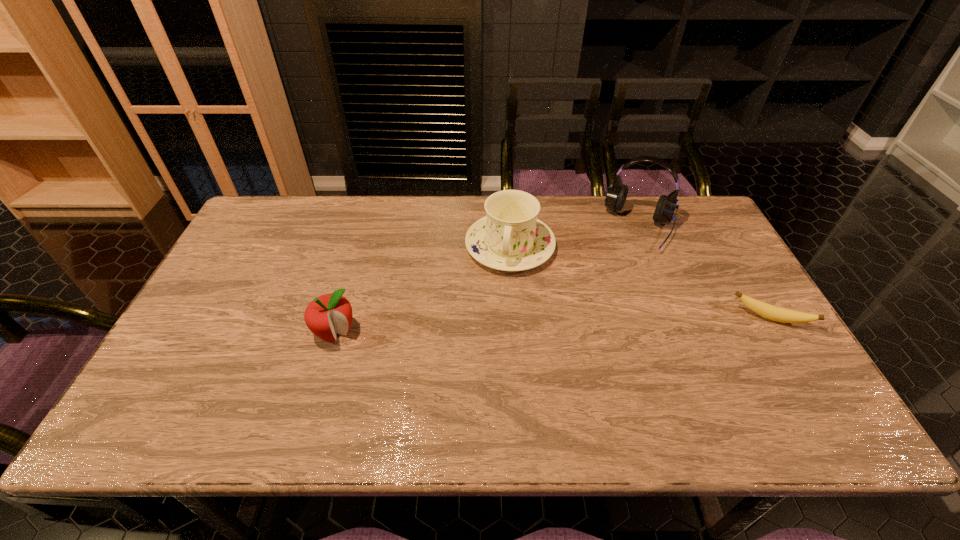
At what (x,y) coordinates should I click in order to perform the action: click on the leftmost object. Please return your answer as a coordinate pair (x, y). Looking at the image, I should click on (329, 314).

Where is `banana`? banana is located at coordinates (784, 315).

Find the location of a particular element. Image resolution: width=960 pixels, height=540 pixels. the shortest object is located at coordinates (784, 315).

Find the location of a particular element. The height and width of the screenshot is (540, 960). headset is located at coordinates (616, 195).

Find the location of `the second object from right to left`. the second object from right to left is located at coordinates (616, 195).

Locate an element on the screen. The image size is (960, 540). the second object from left to right is located at coordinates (510, 237).

Locate an element on the screen. The height and width of the screenshot is (540, 960). free point located 0.140m on the right of the apple is located at coordinates (412, 333).

This screenshot has height=540, width=960. In order to click on vacant position located on the left of the banana in this screenshot , I will do `click(715, 318)`.

The image size is (960, 540). I want to click on free space located on the ear cushions of the tallest object, so click(631, 262).

The width and height of the screenshot is (960, 540). What are the coordinates of `free point located 0.060m on the ear cushions of the tallest object` in the screenshot? It's located at (630, 264).